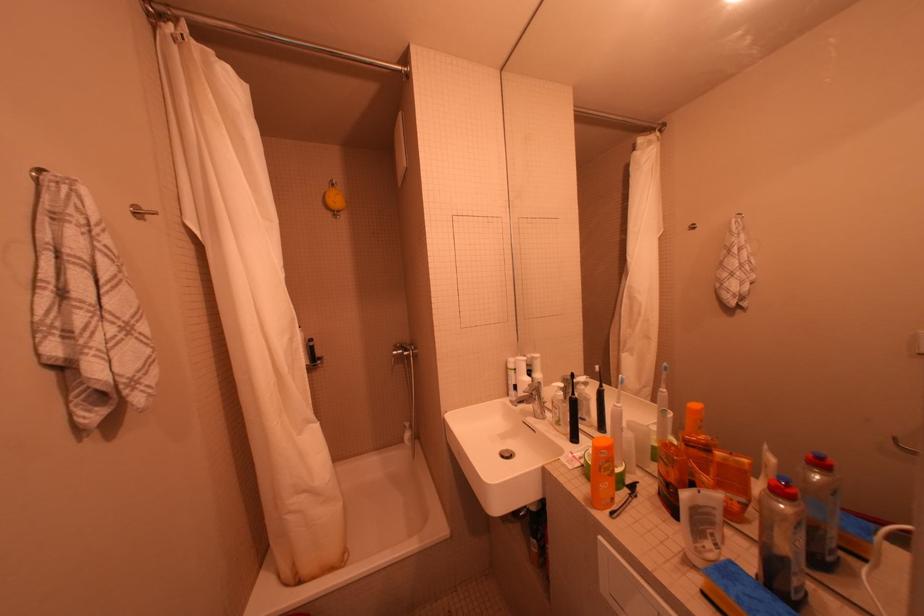
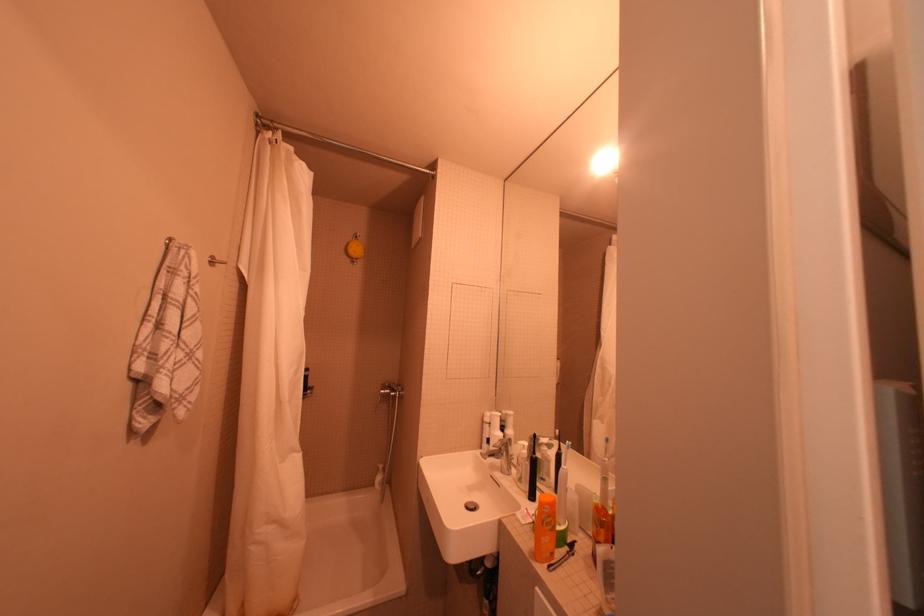
Locate, in the second image, the point that corresponds to point (612, 519) in the first image.

(551, 570)